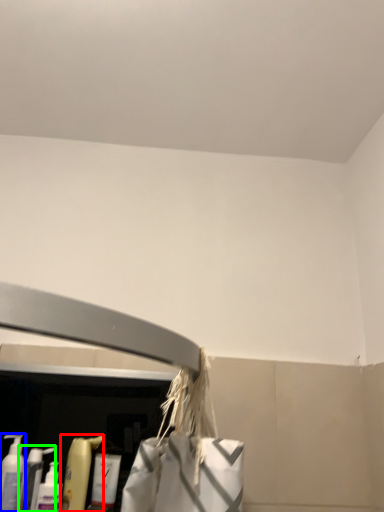
Question: Which object is positioned closest to cleaning product (highlighted by a red box)? Select from cleaning product (highlighted by a blue box) and cleaning product (highlighted by a green box).

Choices:
 (A) cleaning product
 (B) cleaning product

Answer: (B)